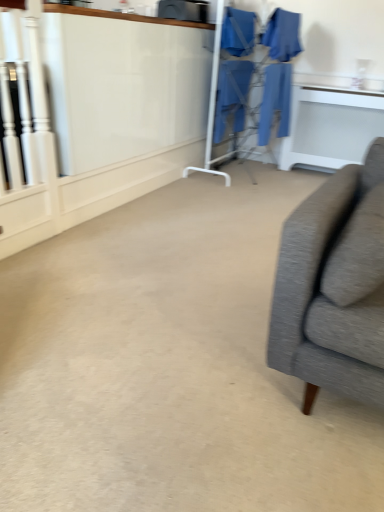
You are a GUI agent. You are given a task and a screenshot of the screen. Output one action in this format:
    pyautogui.click(x=<x>, y=<y>)
    Task: Click on the vacant space underneath blue fabric robe at center, acting as the 4th robe starting from the left (from a real-world perspective)
    The image size is (384, 512).
    Given the screenshot: What is the action you would take?
    pyautogui.click(x=266, y=176)